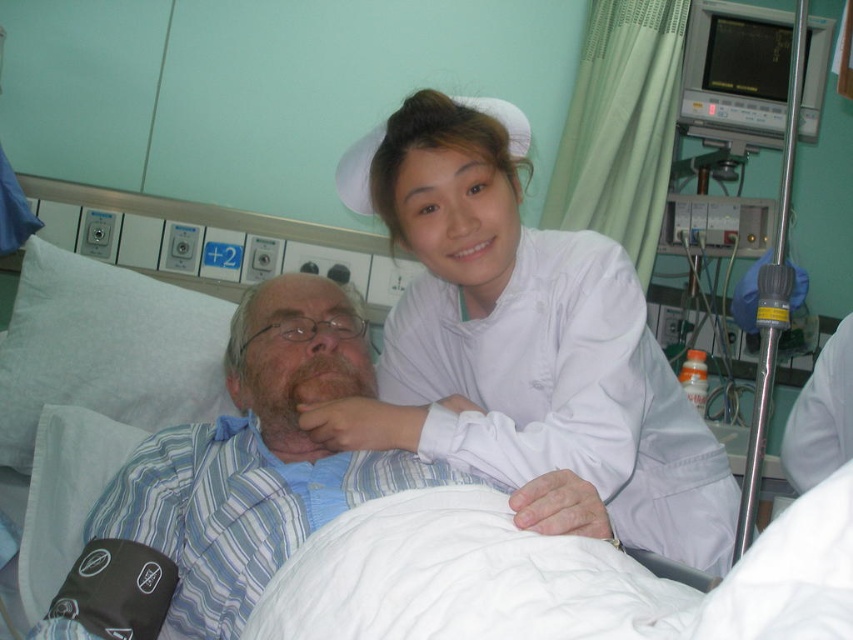
Question: Can you confirm if white smooth nurse cap at upper center is wider than white smooth uniform at upper center?

Choices:
 (A) yes
 (B) no

Answer: (A)

Question: Which of these objects is positioned farthest from the white cotton shirt at center?

Choices:
 (A) white smooth uniform at upper center
 (B) white smooth nurse cap at upper center
 (C) white fabric bed at center

Answer: (A)

Question: Can you confirm if white smooth nurse cap at upper center is bigger than white smooth uniform at upper center?

Choices:
 (A) yes
 (B) no

Answer: (A)

Question: Does white smooth nurse cap at upper center lie behind white fabric bed at center?

Choices:
 (A) yes
 (B) no

Answer: (A)

Question: Estimate the real-world distances between objects in this image. Which object is closer to the white smooth uniform at upper center?

Choices:
 (A) white cotton shirt at center
 (B) white fabric bed at center
 (C) white smooth nurse cap at upper center

Answer: (C)

Question: Among these points, which one is farthest from the camera?

Choices:
 (A) (334, 420)
 (B) (256, 339)
 (C) (817, 387)

Answer: (B)